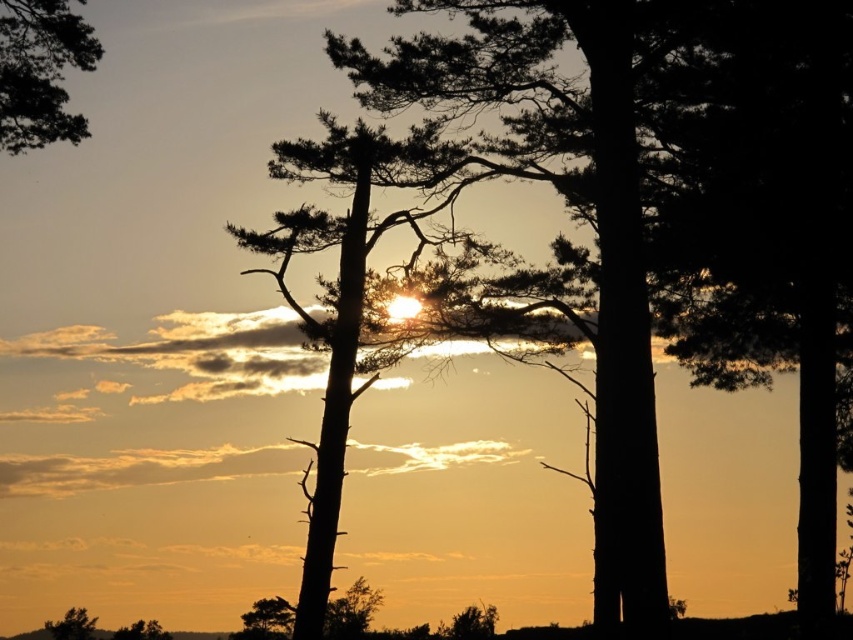
You are standing in the sunset scene and notice two trees at the lower left corner. Which one is positioned more to the left between the silvery bark tree at lower left and the green matte tree at lower left?

The silvery bark tree at lower left is positioned to the left of the green matte tree at lower left, so it is more to the left.

You are an artist trying to paint this sunset scene. You want to ensure the silhouette pine tree at upper left and the silvery bark tree at lower left are proportionally accurate. Which tree should you draw larger in your painting?

The silhouette pine tree at upper left should be drawn larger than the silvery bark tree at lower left because it is bigger according to the description.